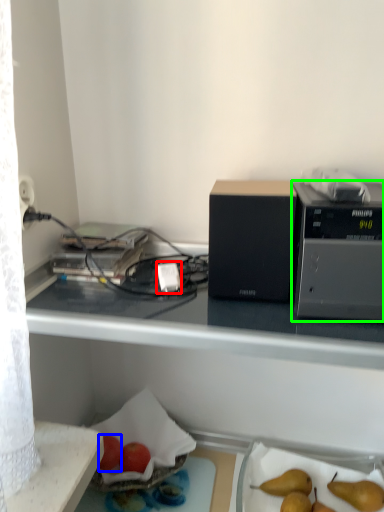
Question: Considering the real-world distances, which object is closest to power plugs and sockets (highlighted by a red box)? apple (highlighted by a blue box) or appliance (highlighted by a green box).

Choices:
 (A) apple
 (B) appliance

Answer: (B)